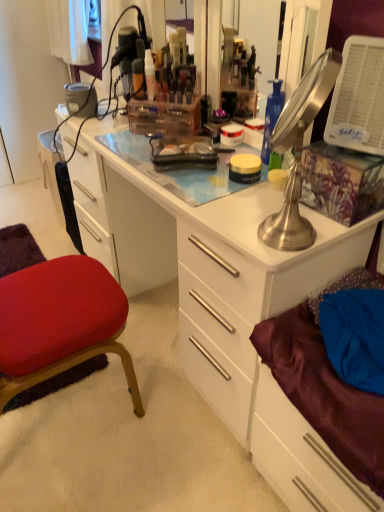
Question: From a real-world perspective, is metallic silver lamp at upper right positioned above or below velvet red cushion at lower left?

Choices:
 (A) below
 (B) above

Answer: (B)

Question: Considering their positions, is metallic silver lamp at upper right located in front of or behind velvet red cushion at lower left?

Choices:
 (A) behind
 (B) front

Answer: (B)

Question: Based on their relative distances, which object is farther from the satin purple drawer at lower right?

Choices:
 (A) velvet red cushion at lower left
 (B) translucent plastic container at upper center, the 1th toiletry in the right-to-left sequence
 (C) white glossy desk at center
 (D) translucent plastic container at upper center, positioned as the second toiletry in right-to-left order
 (E) metallic silver lamp at upper right

Answer: (D)

Question: Which is farther from the white glossy desk at center?

Choices:
 (A) translucent plastic container at upper center, positioned as the second toiletry in right-to-left order
 (B) metallic silver lamp at upper right
 (C) translucent plastic container at upper center, the 1th toiletry in the right-to-left sequence
 (D) velvet red cushion at lower left
 (E) satin purple drawer at lower right

Answer: (A)